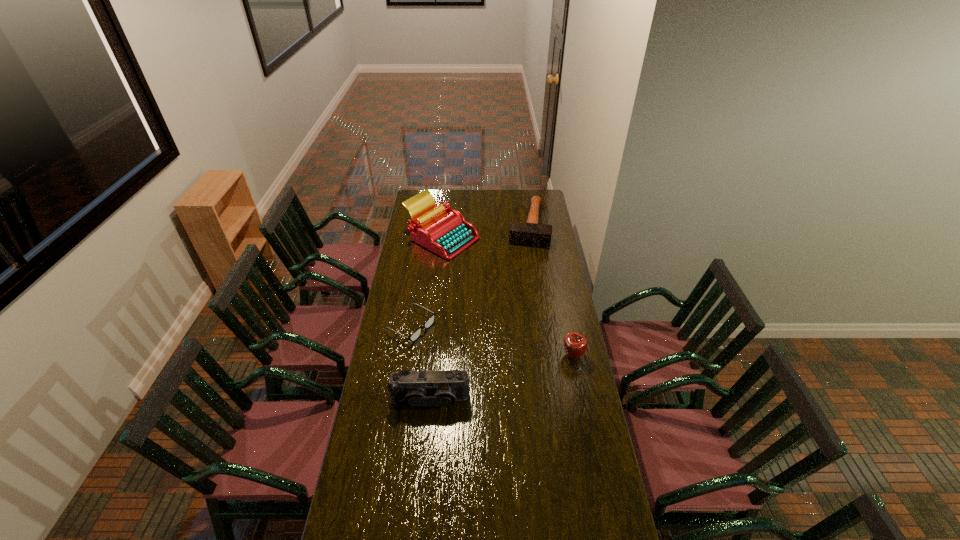
Identify the location of free space between the typewriter and the nearest object. The image size is (960, 540). (436, 319).

The image size is (960, 540). I want to click on empty space between the second shortest object and the fourth farthest object, so click(x=550, y=291).

The image size is (960, 540). In order to click on vacant space that is in between the tallest object and the mallet in this screenshot , I will do `click(485, 232)`.

This screenshot has height=540, width=960. Find the location of `free space between the fourth tallest object and the apple`. free space between the fourth tallest object and the apple is located at coordinates (550, 291).

Identify the location of free space between the apple and the shortest object. pos(492,341).

This screenshot has width=960, height=540. Identify the location of free space between the camcorder and the apple. point(501,377).

Image resolution: width=960 pixels, height=540 pixels. I want to click on vacant area between the mallet and the camcorder, so [479, 313].

Identify the location of free space that is in between the apple and the typewriter. This screenshot has width=960, height=540. (508, 297).

Identify the location of the second closest object relative to the camcorder. The height and width of the screenshot is (540, 960). (575, 344).

Choose which object is the fourth nearest neighbor to the camcorder. Please provide its 2D coordinates. Your answer should be formatted as a tuple, i.e. [(x, y)], where the tuple contains the x and y coordinates of a point satisfying the conditions above.

[(530, 233)]